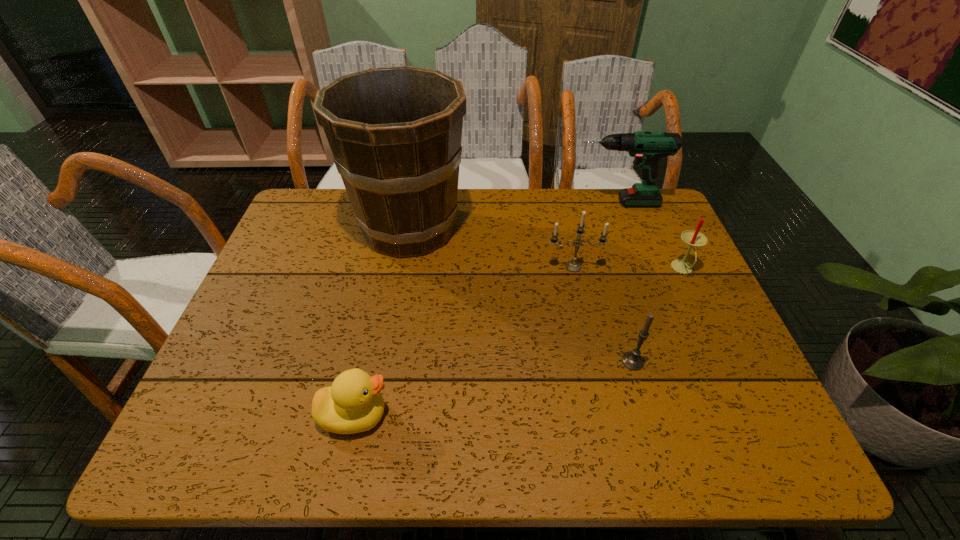
Locate an element on the screen. free space at the near edge is located at coordinates (609, 451).

In the image, there is a desktop. At what (x,y) coordinates should I click in order to perform the action: click on vacant region at the left edge. Please return your answer as a coordinate pair (x, y). This screenshot has width=960, height=540. Looking at the image, I should click on (281, 331).

In the image, there is a desktop. At what (x,y) coordinates should I click in order to perform the action: click on vacant space at the right edge. Please return your answer as a coordinate pair (x, y). This screenshot has width=960, height=540. Looking at the image, I should click on tap(715, 322).

I want to click on blank space at the far left corner of the desktop, so click(294, 210).

In the image, there is a desktop. Where is `vacant space at the near left corner`? This screenshot has height=540, width=960. vacant space at the near left corner is located at coordinates (258, 451).

Find the location of `blank area at the far right corner`. blank area at the far right corner is located at coordinates (620, 220).

Identify the location of free space at the near right corner. The image size is (960, 540). (702, 431).

In order to click on unoccupied area between the nearest object and the drill in this screenshot , I will do `click(485, 309)`.

Where is `free space between the rightmost candle and the drill`? free space between the rightmost candle and the drill is located at coordinates (649, 236).

Image resolution: width=960 pixels, height=540 pixels. I want to click on empty space between the rightmost candle and the drill, so (649, 236).